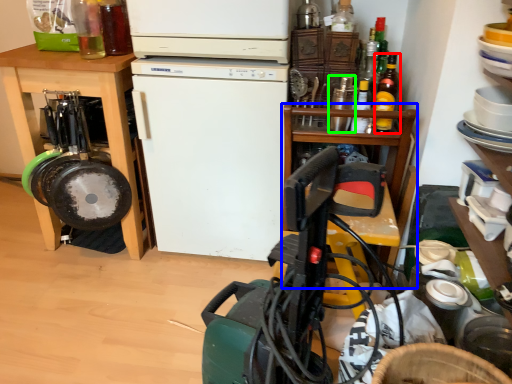
Question: Based on their relative distances, which object is farther from bottle (highlighted by a red box)? Choose from table (highlighted by a blue box) and bottle (highlighted by a green box).

Choices:
 (A) table
 (B) bottle

Answer: (A)